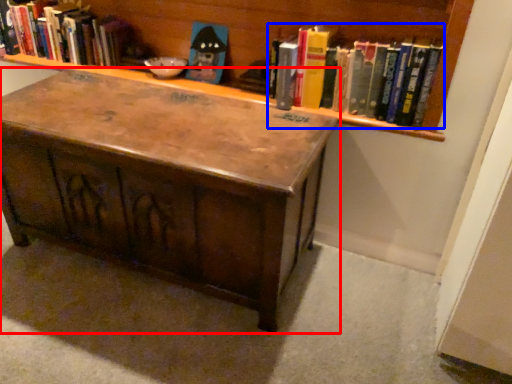
Question: Among these objects, which one is nearest to the camera, table (highlighted by a red box) or book (highlighted by a blue box)?

Choices:
 (A) table
 (B) book

Answer: (A)